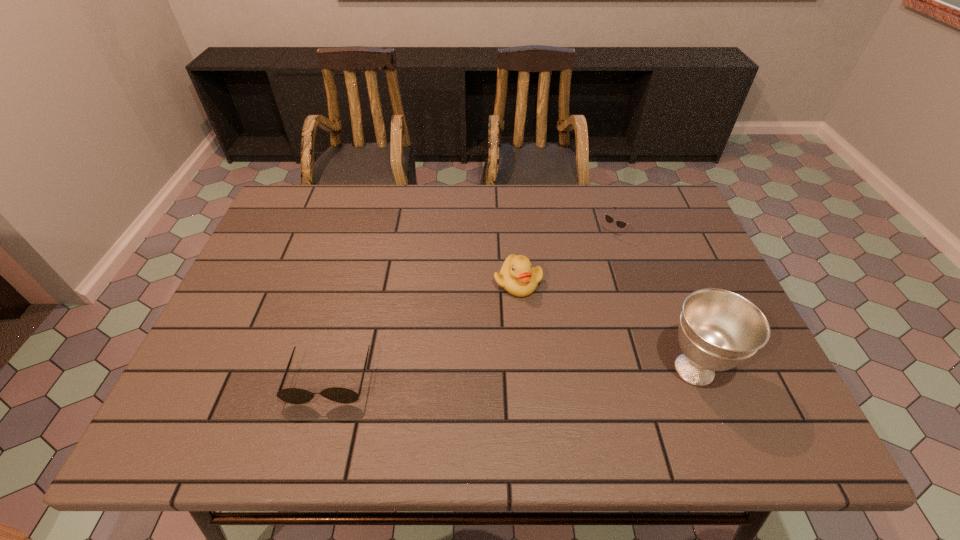
Find the location of `the leftmost object`. the leftmost object is located at coordinates (296, 396).

This screenshot has height=540, width=960. Identify the location of the nearer sunglasses. (296, 396).

Where is `chalice`? chalice is located at coordinates (718, 330).

At what (x,y) coordinates should I click in order to perform the action: click on the farthest object. Please return your answer as a coordinate pair (x, y). Looking at the image, I should click on (621, 224).

Find the location of `the right sunglasses`. the right sunglasses is located at coordinates (621, 224).

At what (x,y) coordinates should I click in order to perform the action: click on the second farthest object. Please return your answer as a coordinate pair (x, y). The image size is (960, 540). Looking at the image, I should click on (517, 276).

Find the location of `duckling`. duckling is located at coordinates (517, 276).

The image size is (960, 540). Find the location of `free space located on the right of the chalice`. free space located on the right of the chalice is located at coordinates (757, 369).

Locate an element on the screen. The image size is (960, 540). vacant area situated 0.140m in front of the lenses of the farther sunglasses is located at coordinates (573, 273).

You are a GUI agent. You are given a task and a screenshot of the screen. Output one action in this format:
    pyautogui.click(x=<x>, y=<y>)
    Task: Click on the free location located in front of the lenses of the farther sunglasses
    The height and width of the screenshot is (540, 960).
    Given the screenshot: What is the action you would take?
    pyautogui.click(x=516, y=334)